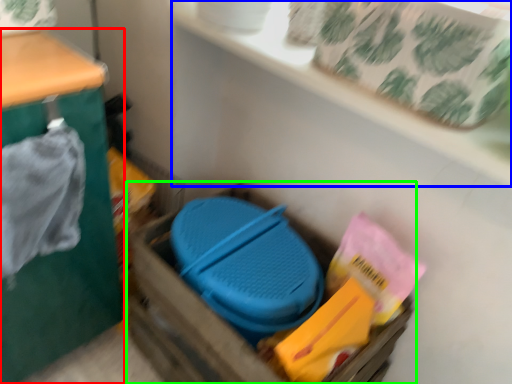
Question: Based on their relative distances, which object is nearer to furniture (highlighted by a red box)? Choose from shelf (highlighted by a blue box) and storage box (highlighted by a green box).

Choices:
 (A) shelf
 (B) storage box

Answer: (B)